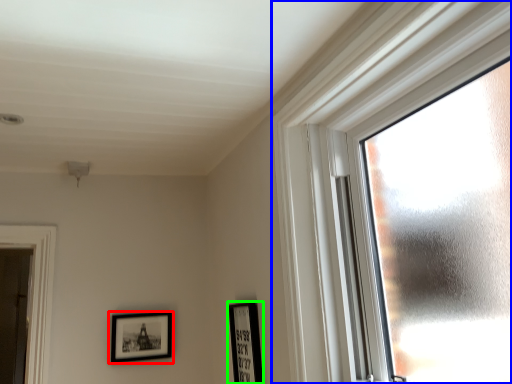
Question: Considering the real-world distances, which object is farthest from picture frame (highlighted by a red box)? window (highlighted by a blue box) or picture frame (highlighted by a green box)?

Choices:
 (A) window
 (B) picture frame

Answer: (A)